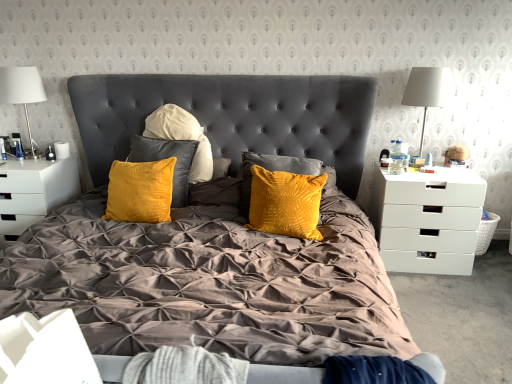
Where is `matte white coffee cup at left`? The height and width of the screenshot is (384, 512). matte white coffee cup at left is located at coordinates (62, 150).

What do you see at coordinates (486, 231) in the screenshot?
I see `white wicker picnic basket at right` at bounding box center [486, 231].

What do you see at coordinates (22, 90) in the screenshot?
I see `white fabric lampshade at left, which is counted as the second lamp, starting from the right` at bounding box center [22, 90].

Where is `white matte drawer at right, the 1th nightstand from the right`? The image size is (512, 384). white matte drawer at right, the 1th nightstand from the right is located at coordinates (426, 220).

Identify the location of matte white coffee cup at left. (62, 150).

Considering the relative sizes of matte white coffee cup at left and white fabric at lower left in the image provided, is matte white coffee cup at left thinner than white fabric at lower left?

Correct, the width of matte white coffee cup at left is less than that of white fabric at lower left.

Considering the positions of objects matte white coffee cup at left and white fabric at lower left in the image provided, who is more to the left, matte white coffee cup at left or white fabric at lower left?

matte white coffee cup at left.

Is white fabric at lower left at the back of matte white coffee cup at left?

No, matte white coffee cup at left's orientation is not away from white fabric at lower left.

What's the angular difference between matte white coffee cup at left and white fabric at lower left's facing directions?

1.71 degrees.

Is velvet yellow pillow at center inside the boundaries of white matte drawer at right, the 1th nightstand from the right, or outside?

velvet yellow pillow at center is outside white matte drawer at right, the 1th nightstand from the right.

How distant is velvet yellow pillow at center from white matte drawer at right, the 1th nightstand from the right?

The distance of velvet yellow pillow at center from white matte drawer at right, the 1th nightstand from the right, is 30.85 inches.

Is velvet yellow pillow at center bigger than white matte drawer at right, acting as the 2th nightstand starting from the left?

Correct, velvet yellow pillow at center is larger in size than white matte drawer at right, acting as the 2th nightstand starting from the left.

How many degrees apart are the facing directions of velvet yellow pillow at center and white matte drawer at right, the 1th nightstand from the right?

They differ by 0.514 degrees in their facing directions.

Based on the photo, is white wicker picnic basket at right not close to white fabric lampshade at left, which is counted as the second lamp, starting from the right?

Yes, white wicker picnic basket at right is far from white fabric lampshade at left, which is counted as the second lamp, starting from the right.

Based on the photo, considering the relative sizes of white wicker picnic basket at right and white fabric lampshade at left, which is counted as the first lamp, starting from the left, in the image provided, is white wicker picnic basket at right wider than white fabric lampshade at left, which is counted as the first lamp, starting from the left,?

Incorrect, the width of white wicker picnic basket at right does not surpass that of white fabric lampshade at left, which is counted as the first lamp, starting from the left.

Considering the relative positions of white wicker picnic basket at right and white fabric lampshade at left, which is counted as the second lamp, starting from the right, in the image provided, is white wicker picnic basket at right in front of white fabric lampshade at left, which is counted as the second lamp, starting from the right,?

No, it is not.

Is white wicker picnic basket at right to the left of white fabric lampshade at left, which is counted as the second lamp, starting from the right, from the viewer's perspective?

Incorrect, white wicker picnic basket at right is not on the left side of white fabric lampshade at left, which is counted as the second lamp, starting from the right.

Does white fabric at lower left have a lesser height compared to clear plastic bottle at right side?

Incorrect, the height of white fabric at lower left does not fall short of that of clear plastic bottle at right side.

Based on the photo, which point is more distant from viewer, (17, 381) or (393, 152)?

The point (393, 152) is behind.

Does white fabric at lower left turn towards clear plastic bottle at right side?

No, white fabric at lower left is not facing towards clear plastic bottle at right side.

Can you see white fabric at lower left touching white fabric lampshade at right, positioned as the 2th lamp in left-to-right order?

No, white fabric at lower left is not next to white fabric lampshade at right, positioned as the 2th lamp in left-to-right order.

Which is in front, white fabric at lower left or white fabric lampshade at right, the first lamp positioned from the right?

white fabric at lower left is closer to the camera.

In the scene shown: Which is more to the left, white fabric at lower left or white fabric lampshade at right, the first lamp positioned from the right?

Positioned to the left is white fabric at lower left.

Which is correct: white fabric at lower left is inside white fabric lampshade at right, positioned as the 2th lamp in left-to-right order, or outside of it?

white fabric at lower left is not inside white fabric lampshade at right, positioned as the 2th lamp in left-to-right order, it's outside.

Does white glossy nightstand at left, placed as the 1th nightstand when sorted from left to right, turn towards matte white coffee cup at left?

No, white glossy nightstand at left, placed as the 1th nightstand when sorted from left to right, is not aimed at matte white coffee cup at left.

Is white glossy nightstand at left, placed as the 1th nightstand when sorted from left to right, closer to camera compared to matte white coffee cup at left?

Yes, white glossy nightstand at left, placed as the 1th nightstand when sorted from left to right, is in front of matte white coffee cup at left.

Is white glossy nightstand at left, placed as the 1th nightstand when sorted from left to right, not near matte white coffee cup at left?

white glossy nightstand at left, placed as the 1th nightstand when sorted from left to right, is actually quite close to matte white coffee cup at left.

From the image's perspective, which is above, white glossy nightstand at left, placed as the 1th nightstand when sorted from left to right, or matte white coffee cup at left?

matte white coffee cup at left is shown above in the image.

Could white fabric lampshade at left, which is counted as the second lamp, starting from the right, be considered to be inside white glossy nightstand at left, the 2th nightstand positioned from the right?

Definitely not — white fabric lampshade at left, which is counted as the second lamp, starting from the right, is not inside white glossy nightstand at left, the 2th nightstand positioned from the right.

Between white glossy nightstand at left, the 2th nightstand positioned from the right, and white fabric lampshade at left, which is counted as the first lamp, starting from the left, which one has larger size?

With larger size is white glossy nightstand at left, the 2th nightstand positioned from the right.

Which of these two, white glossy nightstand at left, placed as the 1th nightstand when sorted from left to right, or white fabric lampshade at left, which is counted as the first lamp, starting from the left, stands shorter?

white glossy nightstand at left, placed as the 1th nightstand when sorted from left to right.

What are the coordinates of `coffee cup located behind the white fabric at lower left` in the screenshot? It's located at (62, 150).

Locate an element on the screen. The height and width of the screenshot is (384, 512). bed on the left of white matte drawer at right, acting as the 2th nightstand starting from the left is located at coordinates (237, 116).

From the image, which object appears to be nearer to white wicker picnic basket at right, white fabric lampshade at right, positioned as the 2th lamp in left-to-right order, or white fabric at lower left?

white fabric lampshade at right, positioned as the 2th lamp in left-to-right order, lies closer to white wicker picnic basket at right than the other object.

Estimate the real-world distances between objects in this image. Which object is closer to white fabric lampshade at left, which is counted as the second lamp, starting from the right, white matte drawer at right, acting as the 2th nightstand starting from the left, or clear plastic bottle at right side?

clear plastic bottle at right side is positioned closer to the anchor white fabric lampshade at left, which is counted as the second lamp, starting from the right.

Based on their spatial positions, is clear plastic bottle at right side or matte white coffee cup at left further from velvet yellow pillow at center?

Among the two, matte white coffee cup at left is located further to velvet yellow pillow at center.

Based on their spatial positions, is white matte drawer at right, the 1th nightstand from the right, or white fabric lampshade at right, the first lamp positioned from the right, closer to clear plastic bottle at right side?

Among the two, white fabric lampshade at right, the first lamp positioned from the right, is located nearer to clear plastic bottle at right side.

Based on their spatial positions, is white glossy nightstand at left, placed as the 1th nightstand when sorted from left to right, or matte white coffee cup at left further from white wicker picnic basket at right?

matte white coffee cup at left lies further to white wicker picnic basket at right than the other object.

Estimate the real-world distances between objects in this image. Which object is closer to white fabric lampshade at right, positioned as the 2th lamp in left-to-right order, matte white coffee cup at left or white wicker picnic basket at right?

Among the two, white wicker picnic basket at right is located nearer to white fabric lampshade at right, positioned as the 2th lamp in left-to-right order.

Looking at the image, which one is located further to white fabric at lower left, white wicker picnic basket at right or white fabric lampshade at right, positioned as the 2th lamp in left-to-right order?

white wicker picnic basket at right lies further to white fabric at lower left than the other object.

Based on their spatial positions, is velvet yellow pillow at center or white glossy nightstand at left, placed as the 1th nightstand when sorted from left to right, further from white fabric lampshade at left, which is counted as the second lamp, starting from the right?

velvet yellow pillow at center is further to white fabric lampshade at left, which is counted as the second lamp, starting from the right.

The height and width of the screenshot is (384, 512). In order to click on bottle located between white fabric lampshade at left, which is counted as the first lamp, starting from the left, and white matte drawer at right, the 1th nightstand from the right, in the left-right direction in this screenshot , I will do `click(396, 159)`.

At what (x,y) coordinates should I click in order to perform the action: click on bottle between white fabric at lower left and white wicker picnic basket at right in the front-back direction. Please return your answer as a coordinate pair (x, y). Looking at the image, I should click on (396, 159).

I want to click on bottle located between white fabric lampshade at left, which is counted as the second lamp, starting from the right, and white wicker picnic basket at right in the left-right direction, so click(396, 159).

At what (x,y) coordinates should I click in order to perform the action: click on bed between white fabric at lower left and white fabric lampshade at right, positioned as the 2th lamp in left-to-right order, from front to back. Please return your answer as a coordinate pair (x, y). The height and width of the screenshot is (384, 512). Looking at the image, I should click on (237, 116).